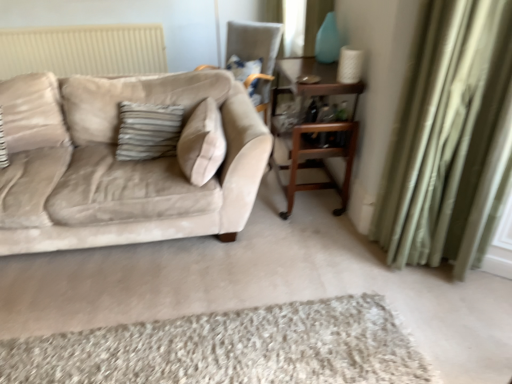
Question: Is shaggy beige rug at lower center inside or outside of beige velvet couch at left?

Choices:
 (A) inside
 (B) outside

Answer: (B)

Question: In terms of width, does shaggy beige rug at lower center look wider or thinner when compared to beige velvet couch at left?

Choices:
 (A) thin
 (B) wide

Answer: (A)

Question: Which of these objects is positioned closest to the velvet beige chair at upper center?

Choices:
 (A) wooden table at center
 (B) beige velvet couch at left
 (C) shaggy beige rug at lower center
 (D) green velvet curtain at right

Answer: (A)

Question: Based on their relative distances, which object is nearer to the green velvet curtain at right?

Choices:
 (A) beige velvet couch at left
 (B) wooden table at center
 (C) shaggy beige rug at lower center
 (D) velvet beige chair at upper center

Answer: (B)